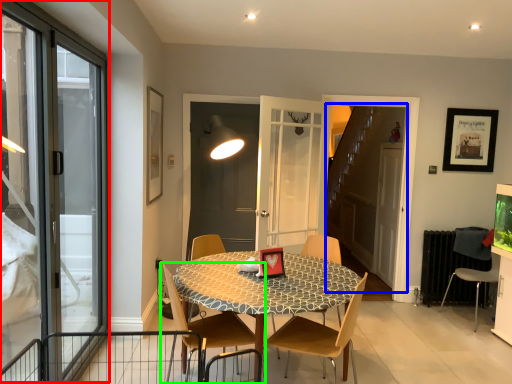
Question: Considering the real-world distances, which object is farthest from window (highlighted by a red box)? elevator (highlighted by a blue box) or chair (highlighted by a green box)?

Choices:
 (A) elevator
 (B) chair

Answer: (A)